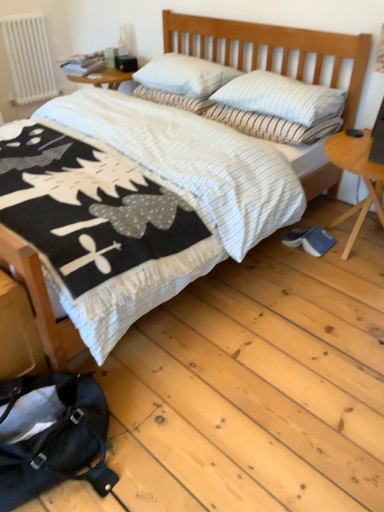
You are a GUI agent. You are given a task and a screenshot of the screen. Output one action in this format:
    pyautogui.click(x=<x>, y=<y>)
    Task: Click on the vacant point above white painted metal radiator at upper left (from a real-world perspective)
    This screenshot has width=384, height=512.
    Given the screenshot: What is the action you would take?
    pyautogui.click(x=22, y=12)